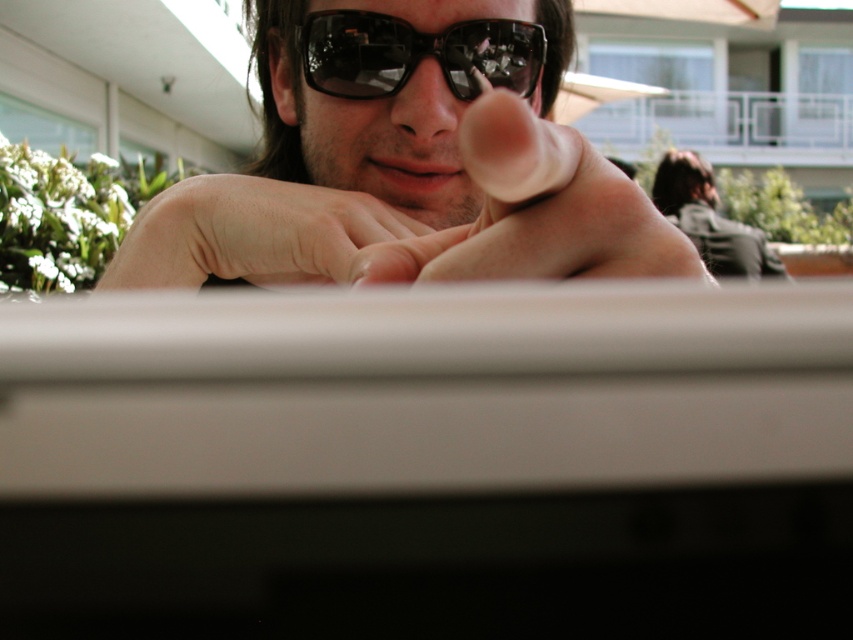
Question: Can you confirm if skinny white hand at center is positioned below black reflective sunglasses at center?

Choices:
 (A) no
 (B) yes

Answer: (B)

Question: Which object is the farthest from the matte black sunglasses at center?

Choices:
 (A) skinny white hand at center
 (B) black reflective sunglasses at center

Answer: (B)

Question: Is matte black sunglasses at center thinner than skinny flesh at center?

Choices:
 (A) no
 (B) yes

Answer: (A)

Question: Is matte black sunglasses at center behind black reflective sunglasses at center?

Choices:
 (A) no
 (B) yes

Answer: (A)

Question: Considering the real-world distances, which object is farthest from the matte black sunglasses at center?

Choices:
 (A) skinny flesh at center
 (B) black reflective sunglasses at center

Answer: (A)

Question: Which point is farther to the camera?

Choices:
 (A) skinny flesh at center
 (B) black reflective sunglasses at center
 (C) matte black sunglasses at center
 (D) skinny white hand at center

Answer: (B)